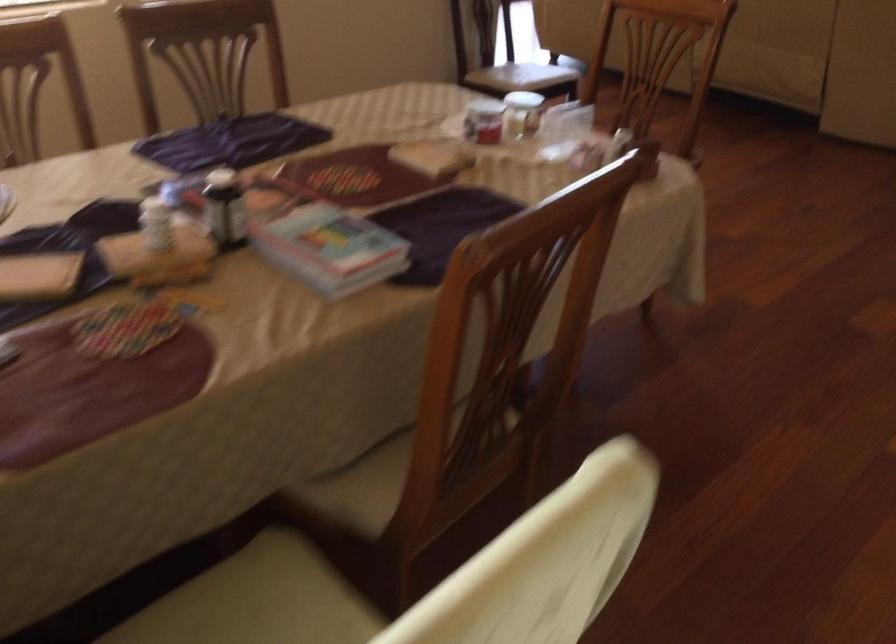
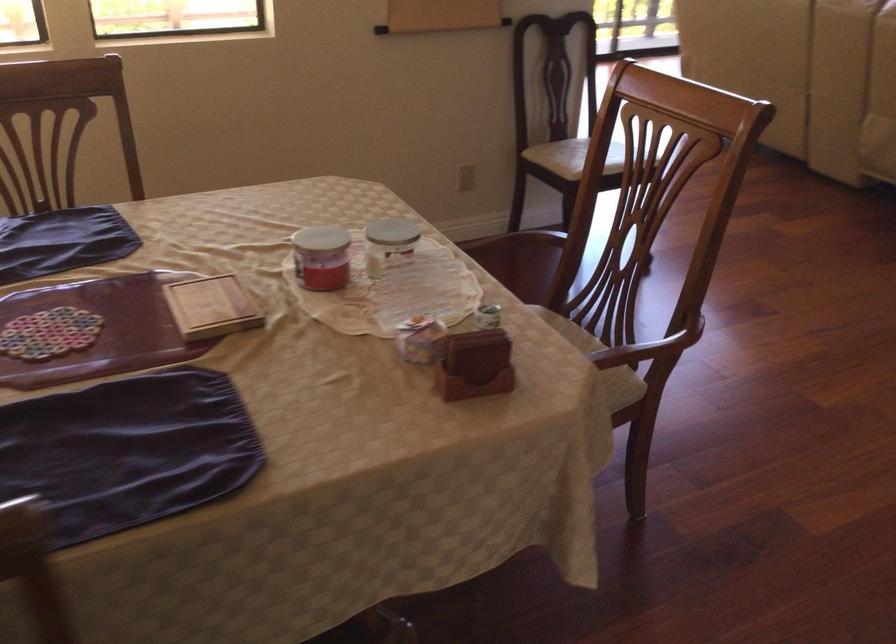
Locate, in the second image, the point that corresponds to the point at 431,156 in the first image.

(211, 307)